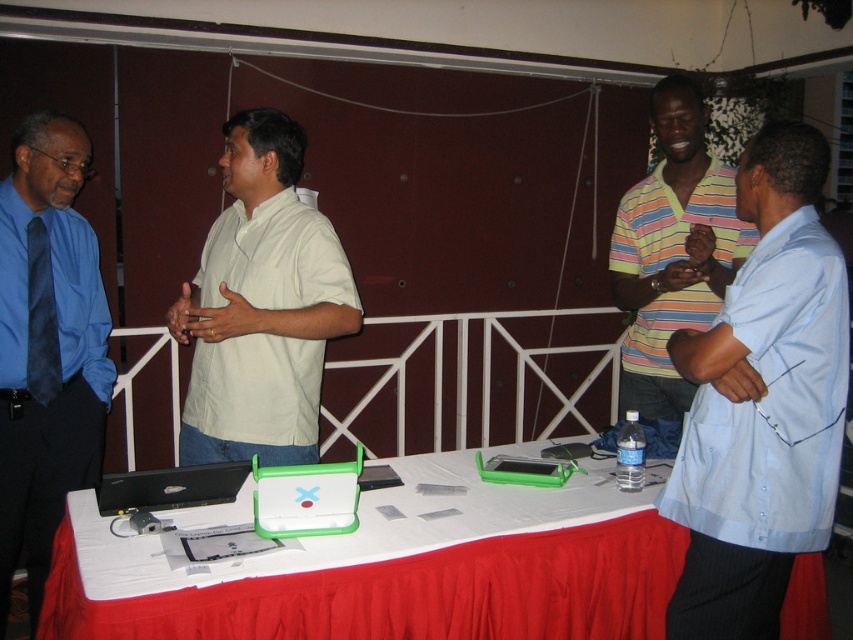
Question: Which of these objects is positioned farthest from the striped cotton shirt at center?

Choices:
 (A) light blue shirt at right
 (B) blue satin shirt at left

Answer: (B)

Question: Which point is closer to the camera?

Choices:
 (A) light blue shirt at right
 (B) light beige cotton shirt at center
 (C) black matte laptop at lower left
 (D) red fabric tablecloth at lower center

Answer: (D)

Question: Does striped cotton shirt at center appear under black matte laptop at lower left?

Choices:
 (A) yes
 (B) no

Answer: (B)

Question: Is red fabric tablecloth at lower center to the right of light beige cotton shirt at center from the viewer's perspective?

Choices:
 (A) yes
 (B) no

Answer: (A)

Question: Is light beige cotton shirt at center smaller than black matte laptop at lower left?

Choices:
 (A) no
 (B) yes

Answer: (A)

Question: Which point is closer to the camera?

Choices:
 (A) black matte laptop at lower left
 (B) light blue shirt at right
 (C) striped cotton shirt at center
 (D) blue satin shirt at left

Answer: (B)